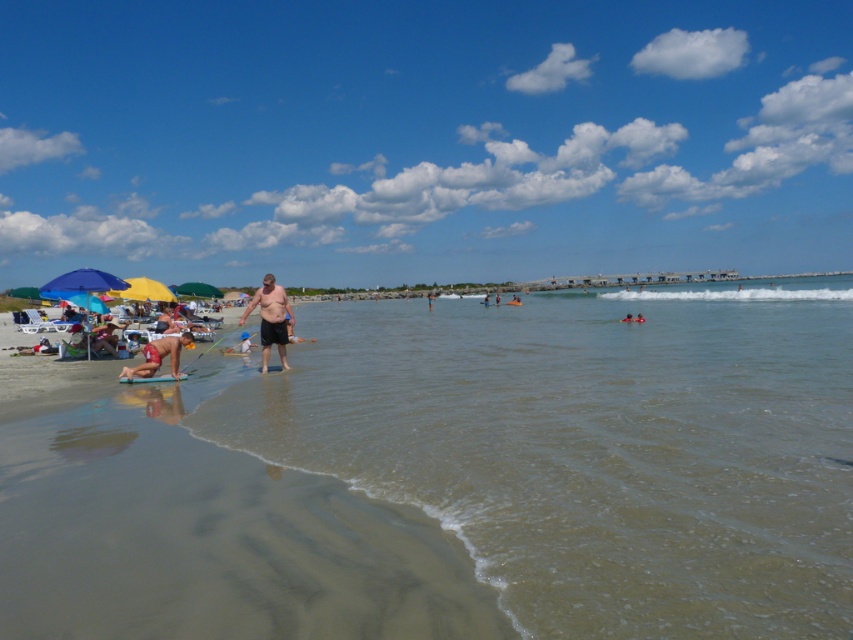
Does dark brown shorts at center have a lesser width compared to smooth skin person at lower center?

In fact, dark brown shorts at center might be wider than smooth skin person at lower center.

Can you confirm if dark brown shorts at center is positioned to the right of smooth skin person at lower center?

Incorrect, dark brown shorts at center is not on the right side of smooth skin person at lower center.

Which is in front, point (265, 365) or point (639, 312)?

Point (265, 365)

Find the location of a particular element. This screenshot has width=853, height=640. dark brown shorts at center is located at coordinates (271, 317).

Which is more to the right, smooth sand beach at center or blue fabric swimmer at center?

blue fabric swimmer at center

Who is more forward, (281, 518) or (627, 320)?

Point (281, 518) is more forward.

The width and height of the screenshot is (853, 640). Find the location of `smooth sand beach at center`. smooth sand beach at center is located at coordinates (209, 534).

Is reddish-brown skin at lower left below smooth skin person at lower center?

Correct, reddish-brown skin at lower left is located below smooth skin person at lower center.

Between point (171, 365) and point (642, 316), which one is positioned behind?

Point (642, 316)

This screenshot has width=853, height=640. Identify the location of reddish-brown skin at lower left. (158, 356).